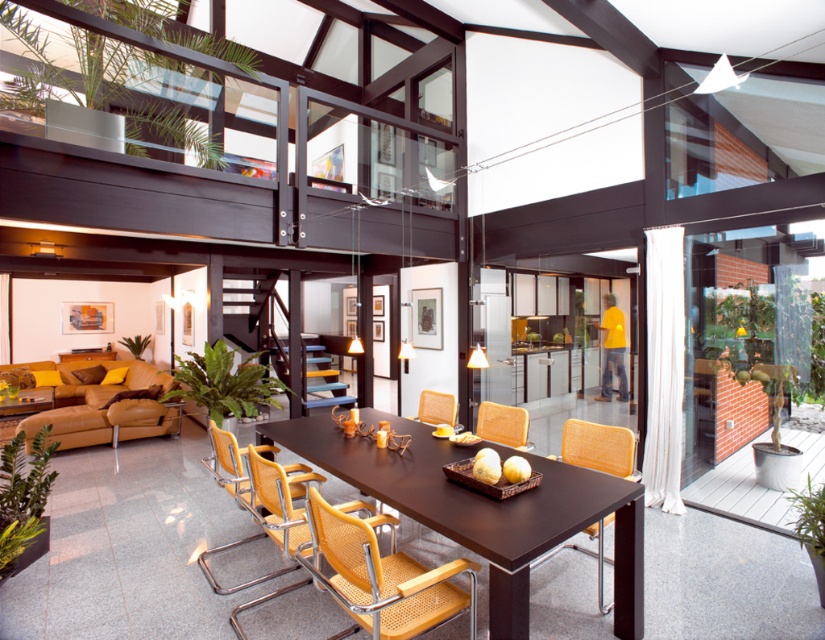
Question: Which of the following is the farthest from the observer?

Choices:
 (A) (508, 424)
 (B) (602, 524)
 (C) (295, 536)
 (D) (519, 310)

Answer: (D)

Question: Does orange woven chair at right lie behind yellow fabric chair at center?

Choices:
 (A) no
 (B) yes

Answer: (A)

Question: Among these objects, which one is nearest to the camera?

Choices:
 (A) yellow woven chair at center
 (B) orange woven armchair at center
 (C) orange woven chair at right
 (D) matte yellow mesh chair at lower center

Answer: (A)

Question: Does transparent glass door at center lie in front of orange woven chair at right?

Choices:
 (A) yes
 (B) no

Answer: (B)

Question: Considering the real-world distances, which object is farthest from the brown wood table at center?

Choices:
 (A) matte woven armchair at center
 (B) woven wood chair at center
 (C) yellow woven chair at center

Answer: (B)

Question: Is matte yellow mesh chair at lower center behind orange woven chair at right?

Choices:
 (A) yes
 (B) no

Answer: (B)